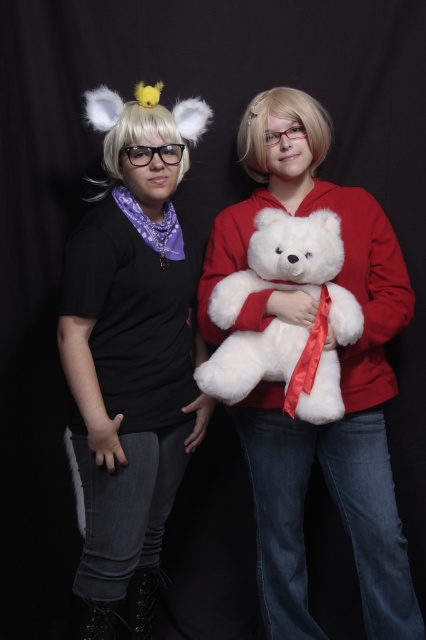
Is point (160, 492) farther from camera compared to point (264, 269)?

Yes, it is behind point (264, 269).

Who is positioned more to the right, fuzzy white wig at left or white plush bear at center?

white plush bear at center is more to the right.

Which is in front, point (164, 262) or point (238, 358)?

Positioned in front is point (238, 358).

Identify the location of fuzzy white wig at left. The height and width of the screenshot is (640, 426). (131, 355).